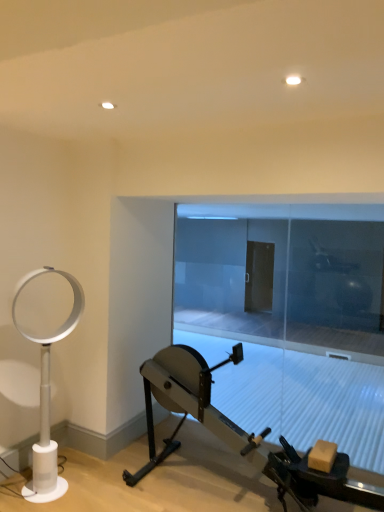
Locate an element on the screen. This screenshot has height=512, width=384. free spot behind white plastic fan at left is located at coordinates (80, 463).